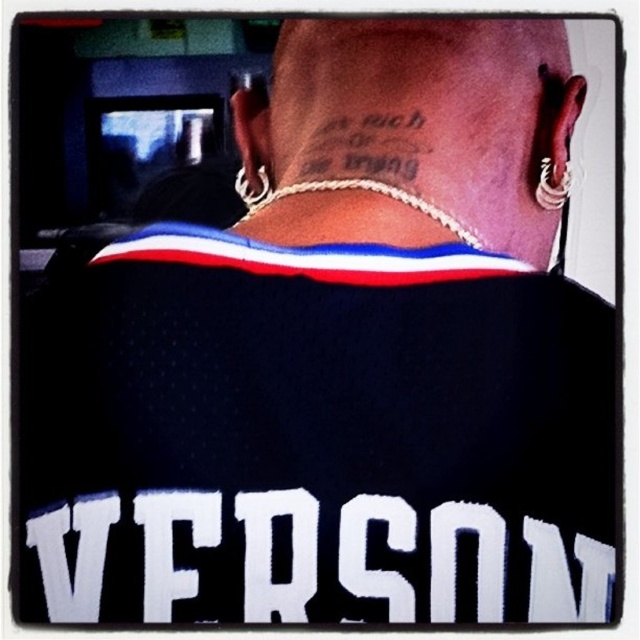
Question: Estimate the real-world distances between objects in this image. Which object is closer to the white fabric jersey at center?

Choices:
 (A) black skin tattoo at center
 (B) black ink tattoo at center

Answer: (A)

Question: Can you confirm if black skin tattoo at center is thinner than black ink tattoo at center?

Choices:
 (A) yes
 (B) no

Answer: (B)

Question: From the image, what is the correct spatial relationship of white fabric jersey at center in relation to black ink tattoo at center?

Choices:
 (A) below
 (B) above

Answer: (A)

Question: Which point appears closest to the camera in this image?

Choices:
 (A) coord(380,572)
 (B) coord(400,132)

Answer: (A)

Question: Is black skin tattoo at center positioned before black ink tattoo at center?

Choices:
 (A) no
 (B) yes

Answer: (B)

Question: Which of the following is the closest to the observer?

Choices:
 (A) (433, 602)
 (B) (310, 154)

Answer: (A)